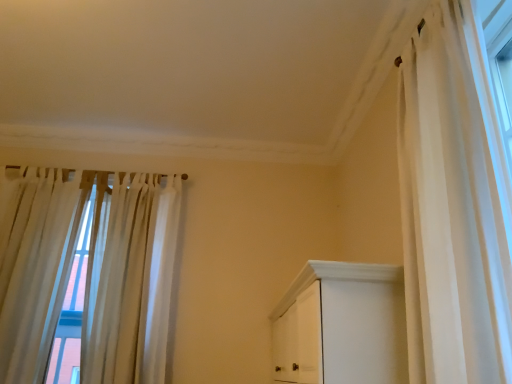
Question: Does point (20, 198) appear closer or farther from the camera than point (161, 355)?

Choices:
 (A) closer
 (B) farther

Answer: (B)

Question: From a real-world perspective, relative to sheer white curtains at left, which is the 3th curtain from front to back, is white sheer curtain at left, the second curtain viewed from the back, vertically above or below?

Choices:
 (A) above
 (B) below

Answer: (B)

Question: Which object is positioned closest to the white sheer curtain at right, the 3th curtain viewed from the back?

Choices:
 (A) white sheer curtain at left, the second curtain viewed from the back
 (B) sheer white curtains at left, acting as the second curtain starting from the left

Answer: (B)

Question: Based on their relative distances, which object is farther from the white sheer curtain at left, the third curtain positioned from the right?

Choices:
 (A) white sheer curtain at right, the 1th curtain in the right-to-left sequence
 (B) sheer white curtains at left, which is the 3th curtain from front to back

Answer: (A)